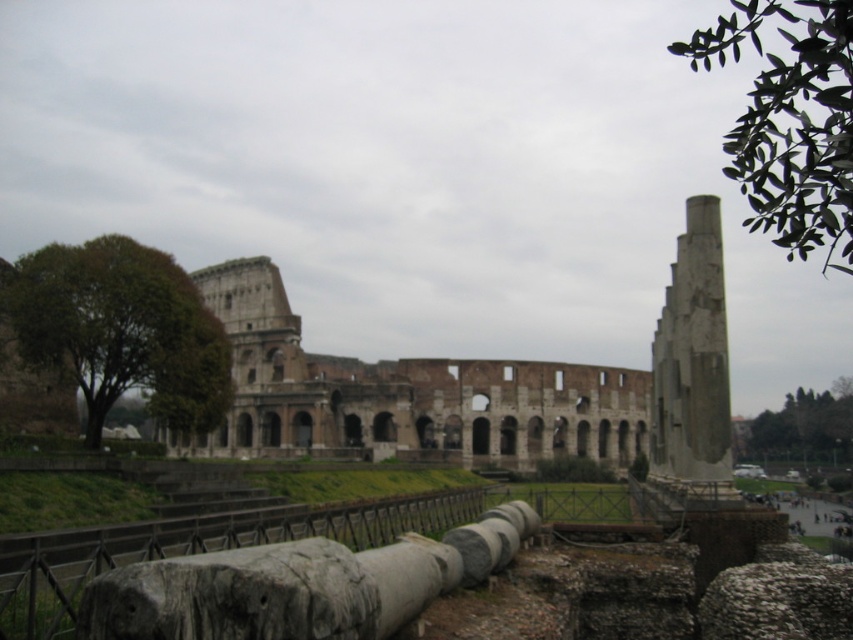
You are an archaeologist examining the site. You need to determine which object is wider between the brown stone ruins at center and the gray stone column at right. Which one is wider?

The brown stone ruins at center is wider than the gray stone column at right according to the description.

You are a tourist standing at a safe distance from the brown stone ruins at center. The park authority requires visitors to stay at least 100 meters away from the ruins to protect them. Are you within the allowed distance?

The distance between you and the brown stone ruins at center is 92.80 meters, which is less than the required 100 meters. You are too close and should move back to comply with the park authority guidelines.

Looking at this image, what is the exact coordinate of the brown stone ruins at center?

The brown stone ruins at center are located at point (480, 385).